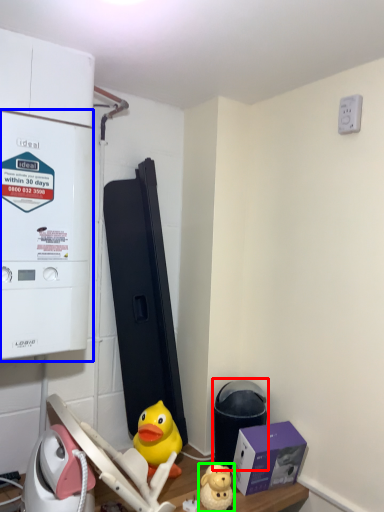
Question: Which is farther away from water heater (highlighted by a red box)? appliance (highlighted by a blue box) or toy (highlighted by a green box)?

Choices:
 (A) appliance
 (B) toy

Answer: (A)